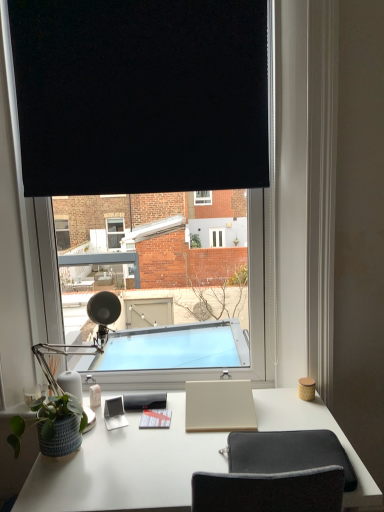
Locate an element on the screen. white matte desk at center is located at coordinates 125,467.

Where is `beige matte notepad at center, the first notepad viewed from the right`? beige matte notepad at center, the first notepad viewed from the right is located at coordinates (219, 406).

What do you see at coordinates (68, 354) in the screenshot? I see `matte black table lamp at left` at bounding box center [68, 354].

Describe the element at coordinates (155, 418) in the screenshot. The height and width of the screenshot is (512, 384). I see `white paper notepad at center, the second notepad in the right-to-left sequence` at that location.

The image size is (384, 512). I want to click on black fabric at upper center, so click(x=140, y=95).

Based on the photo, between matte black table lamp at left and green matte plant pot at lower left, which one has more height?

Standing taller between the two is matte black table lamp at left.

Is point (95, 297) positioned in front of point (57, 421)?

No.

From the image's perspective, is matte black table lamp at left over green matte plant pot at lower left?

Indeed, from the image's perspective, matte black table lamp at left is shown above green matte plant pot at lower left.

Based on the photo, which object is closer to the camera, black fabric at upper center or white matte desk at center?

white matte desk at center is closer to the camera.

Is the surface of black fabric at upper center in direct contact with white matte desk at center?

black fabric at upper center and white matte desk at center are clearly separated.

From a real-world perspective, who is located lower, black fabric at upper center or white matte desk at center?

From a 3D spatial view, white matte desk at center is below.

What's the angular difference between black fabric at upper center and white matte desk at center's facing directions?

They differ by 176 degrees in their facing directions.

Which of these two, green matte plant pot at lower left or black fabric at upper center, stands taller?

Standing taller between the two is black fabric at upper center.

From the image's perspective, which object appears higher, green matte plant pot at lower left or black fabric at upper center?

From the image's view, black fabric at upper center is above.

Is green matte plant pot at lower left positioned in front of black fabric at upper center?

Yes, green matte plant pot at lower left is in front of black fabric at upper center.

Can you confirm if green matte plant pot at lower left is smaller than black fabric at upper center?

Yes.

From a real-world perspective, who is located lower, black matte window at center or green matte plant pot at lower left?

green matte plant pot at lower left.

Identify the location of window above the green matte plant pot at lower left (from a real-world perspective). This screenshot has height=512, width=384. (150, 106).

In the scene shown: Does black matte window at center have a greater width compared to green matte plant pot at lower left?

Correct, the width of black matte window at center exceeds that of green matte plant pot at lower left.

Is point (65, 189) positioned behind point (51, 423)?

Yes, it is.

Based on the photo, could you tell me if green matte plant pot at lower left is facing matte gray notepad at center, placed as the 1th notepad when sorted from left to right?

No, green matte plant pot at lower left is not oriented towards matte gray notepad at center, placed as the 1th notepad when sorted from left to right.

Is green matte plant pot at lower left taller or shorter than matte gray notepad at center, placed as the 1th notepad when sorted from left to right?

In the image, green matte plant pot at lower left appears to be taller than matte gray notepad at center, placed as the 1th notepad when sorted from left to right.

From the picture: From a real-world perspective, does green matte plant pot at lower left sit lower than matte gray notepad at center, which is the 3th notepad from right to left?

Incorrect, from a real-world perspective, green matte plant pot at lower left is higher than matte gray notepad at center, which is the 3th notepad from right to left.

From the image's perspective, relative to matte gray notepad at center, placed as the 1th notepad when sorted from left to right, is green matte plant pot at lower left above or below?

From the image's perspective, green matte plant pot at lower left appears above matte gray notepad at center, placed as the 1th notepad when sorted from left to right.

Does matte black table lamp at left contain dark gray fabric computer chair at lower center?

No.

Which of these two, matte black table lamp at left or dark gray fabric computer chair at lower center, stands shorter?

dark gray fabric computer chair at lower center.

How distant is matte black table lamp at left from dark gray fabric computer chair at lower center?

A distance of 26.02 inches exists between matte black table lamp at left and dark gray fabric computer chair at lower center.

Considering the relative sizes of matte black table lamp at left and dark gray fabric computer chair at lower center in the image provided, is matte black table lamp at left thinner than dark gray fabric computer chair at lower center?

Correct, the width of matte black table lamp at left is less than that of dark gray fabric computer chair at lower center.

Considering the positions of objects white paper notepad at center, the second notepad in the right-to-left sequence, and black matte window at center in the image provided, who is more to the left, white paper notepad at center, the second notepad in the right-to-left sequence, or black matte window at center?

black matte window at center.

Is white paper notepad at center, placed as the second notepad when sorted from left to right, aimed at black matte window at center?

No, white paper notepad at center, placed as the second notepad when sorted from left to right, is not aimed at black matte window at center.

From a real-world perspective, does white paper notepad at center, the second notepad in the right-to-left sequence, stand above black matte window at center?

No, from a real-world perspective, white paper notepad at center, the second notepad in the right-to-left sequence, is not above black matte window at center.

Considering the positions of objects white paper notepad at center, placed as the second notepad when sorted from left to right, and black matte window at center in the image provided, who is in front, white paper notepad at center, placed as the second notepad when sorted from left to right, or black matte window at center?

black matte window at center is in front.

This screenshot has width=384, height=512. In order to click on houseplant below the matte black table lamp at left (from a real-world perspective) in this screenshot , I will do `click(59, 424)`.

There is a white matte desk at center. In order to click on window screen above it (from a real-world perspective) in this screenshot , I will do `click(140, 95)`.

Which object lies nearer to the anchor point matte gray notepad at center, which is the 3th notepad from right to left, black fabric at upper center or matte black table lamp at left?

matte black table lamp at left.

Estimate the real-world distances between objects in this image. Which object is further from white matte desk at center, matte black table lamp at left or green matte plant pot at lower left?

Among the two, matte black table lamp at left is located further to white matte desk at center.

Considering their positions, is white matte desk at center positioned further to white paper notepad at center, the second notepad in the right-to-left sequence, than black matte window at center?

The object further to white paper notepad at center, the second notepad in the right-to-left sequence, is black matte window at center.

Based on their spatial positions, is black matte window at center or dark gray fabric computer chair at lower center further from matte black table lamp at left?

black matte window at center is further to matte black table lamp at left.

From the image, which object appears to be farther from black fabric at upper center, dark gray fabric computer chair at lower center or white paper notepad at center, the second notepad in the right-to-left sequence?

Among the two, white paper notepad at center, the second notepad in the right-to-left sequence, is located further to black fabric at upper center.

When comparing their distances from beige matte notepad at center, marked as the 3th notepad in a left-to-right arrangement, does green matte plant pot at lower left or white matte desk at center seem closer?

Among the two, white matte desk at center is located nearer to beige matte notepad at center, marked as the 3th notepad in a left-to-right arrangement.

Based on their spatial positions, is white paper notepad at center, placed as the second notepad when sorted from left to right, or black matte window at center further from black fabric at upper center?

white paper notepad at center, placed as the second notepad when sorted from left to right, lies further to black fabric at upper center than the other object.

When comparing their distances from dark gray fabric computer chair at lower center, does black fabric at upper center or matte gray notepad at center, which is the 3th notepad from right to left, seem further?

black fabric at upper center is positioned further to the anchor dark gray fabric computer chair at lower center.

At what (x,y) coordinates should I click in order to perform the action: click on notepad between black fabric at upper center and green matte plant pot at lower left in the up-down direction. Please return your answer as a coordinate pair (x, y). Looking at the image, I should click on (219, 406).

Locate an element on the screen. computer chair between black fabric at upper center and white matte desk at center vertically is located at coordinates (287, 453).

The height and width of the screenshot is (512, 384). I want to click on table lamp located between green matte plant pot at lower left and white matte desk at center in the left-right direction, so click(68, 354).

Find the location of `table lamp between black fabric at upper center and dark gray fabric computer chair at lower center from top to bottom`. table lamp between black fabric at upper center and dark gray fabric computer chair at lower center from top to bottom is located at coordinates (68, 354).